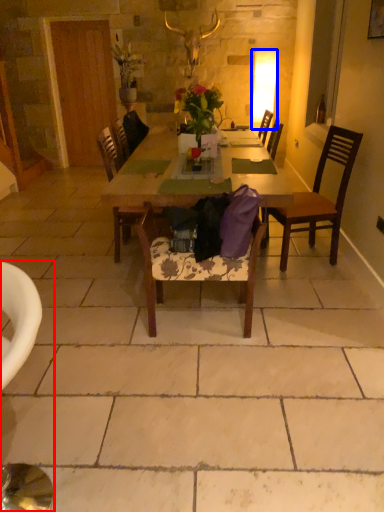
Question: Which object is further to the camera taking this photo, chair (highlighted by a red box) or lamp (highlighted by a blue box)?

Choices:
 (A) chair
 (B) lamp

Answer: (B)